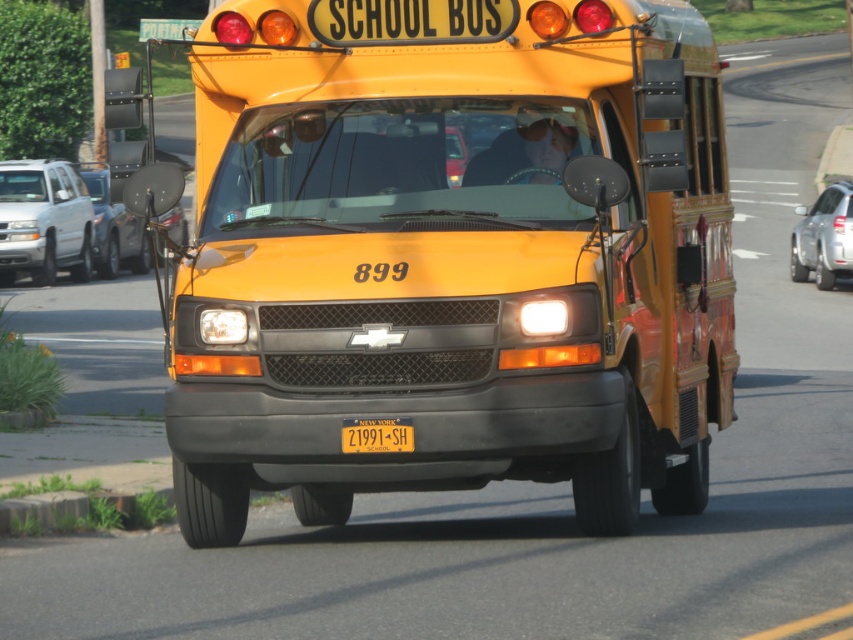
How far apart are metallic silver car at left and yellow matte license plate at center?

metallic silver car at left is 13.12 feet away from yellow matte license plate at center.

Who is lower down, metallic silver car at left or yellow matte license plate at center?

yellow matte license plate at center

Is point (96, 168) behind point (364, 445)?

Yes, point (96, 168) is farther from viewer.

At what (x,y) coordinates should I click in order to perform the action: click on metallic silver car at left. Please return your answer as a coordinate pair (x, y). This screenshot has width=853, height=640. Looking at the image, I should click on (114, 225).

Is point (831, 257) behind point (103, 237)?

That is False.

Can you confirm if satin silver car at right is wider than metallic silver car at left?

Incorrect, satin silver car at right's width does not surpass metallic silver car at left's.

Does point (817, 198) come in front of point (115, 241)?

Yes, it is.

In order to click on satin silver car at right in this screenshot , I will do `click(822, 237)`.

Is point (50, 250) positioned in front of point (97, 173)?

Yes.

Which of these two, white matte suv at left or metallic silver car at left, stands taller?

metallic silver car at left is taller.

Is point (41, 252) positioned behind point (111, 182)?

Yes, it is.

Where is `white matte suv at left`? Image resolution: width=853 pixels, height=640 pixels. white matte suv at left is located at coordinates (44, 220).